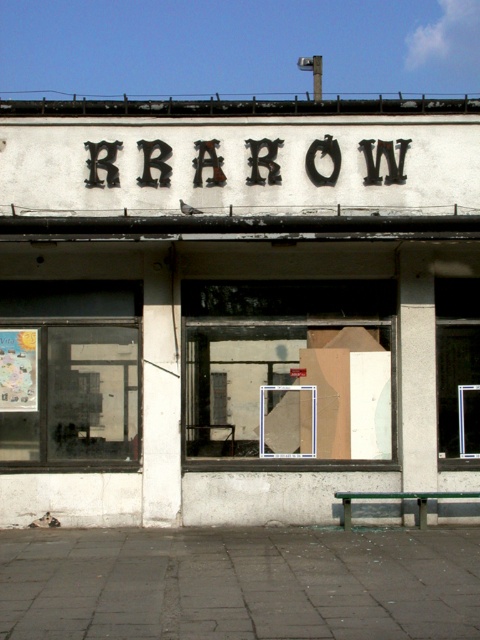
Question: Observing the image, what is the correct spatial positioning of transparent glass window at right in reference to black metal sign at center?

Choices:
 (A) above
 (B) below

Answer: (B)

Question: Which object is closer to the camera taking this photo?

Choices:
 (A) wooden bulletin board at center
 (B) transparent glass window at left

Answer: (B)

Question: Does white concrete storefront at center come behind transparent glass window at left?

Choices:
 (A) no
 (B) yes

Answer: (B)

Question: Is transparent glass window at left wider than transparent glass window at right?

Choices:
 (A) no
 (B) yes

Answer: (B)

Question: Which object is farther from the camera taking this photo?

Choices:
 (A) wooden bulletin board at center
 (B) white concrete storefront at center

Answer: (A)

Question: Which point is closer to the camera?

Choices:
 (A) black metal sign at center
 (B) wooden bulletin board at center
 (C) white concrete storefront at center

Answer: (C)